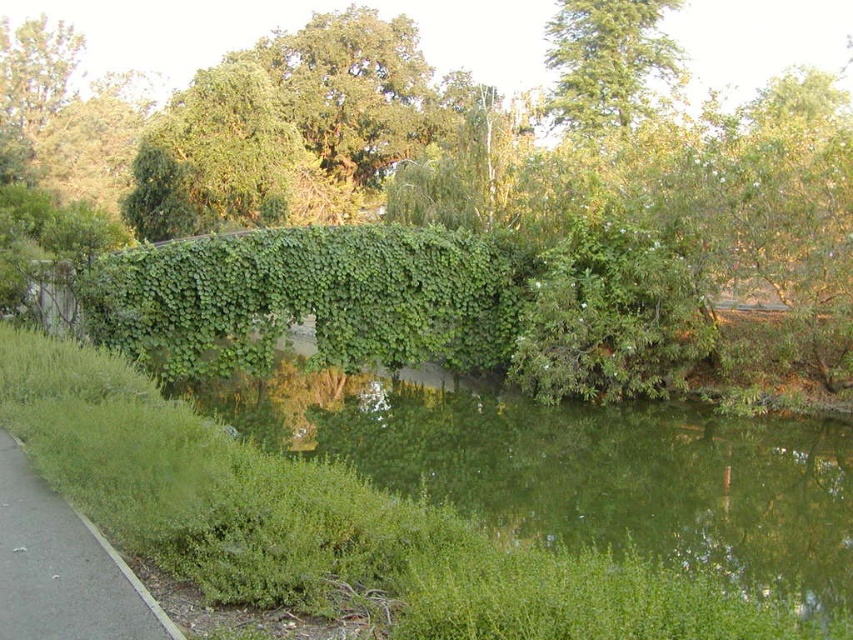
How far apart are green leafy river at center and green grass at lower left?

green leafy river at center and green grass at lower left are 8.52 meters apart.

Is the position of green leafy river at center more distant than that of green grass at lower left?

Yes, it is behind green grass at lower left.

This screenshot has width=853, height=640. What do you see at coordinates (576, 467) in the screenshot?
I see `green leafy river at center` at bounding box center [576, 467].

Find the location of a particular element. green leafy river at center is located at coordinates (576, 467).

Which of these two, green leafy hedge at center or green grass at lower left, stands shorter?

green grass at lower left

In the scene shown: Is green leafy hedge at center bigger than green grass at lower left?

No.

This screenshot has width=853, height=640. Find the location of `green leafy hedge at center`. green leafy hedge at center is located at coordinates (309, 298).

The height and width of the screenshot is (640, 853). What do you see at coordinates (167, 28) in the screenshot?
I see `green leafy tree at center` at bounding box center [167, 28].

Who is more distant from viewer, (149,68) or (138,616)?

The point (149,68) is behind.

Locate an element on the screen. green leafy tree at center is located at coordinates (167, 28).